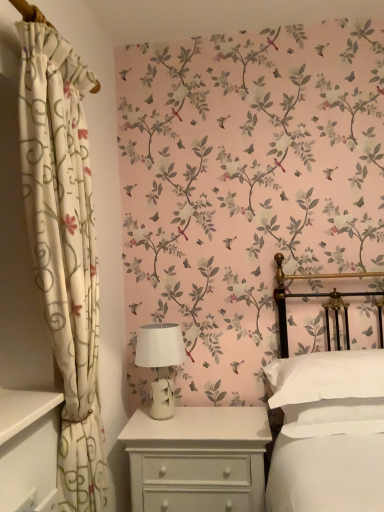
Question: Considering the relative sizes of white soft pillow at right and white ceramic table lamp at center in the image provided, is white soft pillow at right wider than white ceramic table lamp at center?

Choices:
 (A) no
 (B) yes

Answer: (B)

Question: Is white soft pillow at right bigger than white ceramic table lamp at center?

Choices:
 (A) no
 (B) yes

Answer: (B)

Question: From a real-world perspective, is white soft pillow at right located higher than white ceramic table lamp at center?

Choices:
 (A) no
 (B) yes

Answer: (A)

Question: Does white soft pillow at right lie in front of white ceramic table lamp at center?

Choices:
 (A) yes
 (B) no

Answer: (A)

Question: From a real-world perspective, is white soft pillow at right positioned under white ceramic table lamp at center based on gravity?

Choices:
 (A) no
 (B) yes

Answer: (B)

Question: Choose the correct answer: Is white soft pillow at right inside white ceramic table lamp at center or outside it?

Choices:
 (A) outside
 (B) inside

Answer: (A)

Question: From the image's perspective, is white soft pillow at right located above or below white ceramic table lamp at center?

Choices:
 (A) above
 (B) below

Answer: (B)

Question: Considering the positions of point (306, 370) and point (180, 330), is point (306, 370) closer or farther from the camera than point (180, 330)?

Choices:
 (A) farther
 (B) closer

Answer: (B)

Question: Considering the positions of white soft pillow at right and white ceramic table lamp at center in the image, is white soft pillow at right wider or thinner than white ceramic table lamp at center?

Choices:
 (A) thin
 (B) wide

Answer: (B)

Question: From the image's perspective, is white floral fabric curtain at left above or below white ceramic table lamp at center?

Choices:
 (A) above
 (B) below

Answer: (A)

Question: Is white floral fabric curtain at left inside the boundaries of white ceramic table lamp at center, or outside?

Choices:
 (A) inside
 (B) outside

Answer: (B)

Question: In the image, is white floral fabric curtain at left positioned in front of or behind white ceramic table lamp at center?

Choices:
 (A) behind
 (B) front

Answer: (B)

Question: In the image, is white floral fabric curtain at left on the left side or the right side of white ceramic table lamp at center?

Choices:
 (A) left
 (B) right

Answer: (A)

Question: From a real-world perspective, relative to white floral fabric curtain at left, is white soft pillow at right vertically above or below?

Choices:
 (A) below
 (B) above

Answer: (A)

Question: Considering the positions of white soft pillow at right and white floral fabric curtain at left in the image, is white soft pillow at right taller or shorter than white floral fabric curtain at left?

Choices:
 (A) short
 (B) tall

Answer: (A)